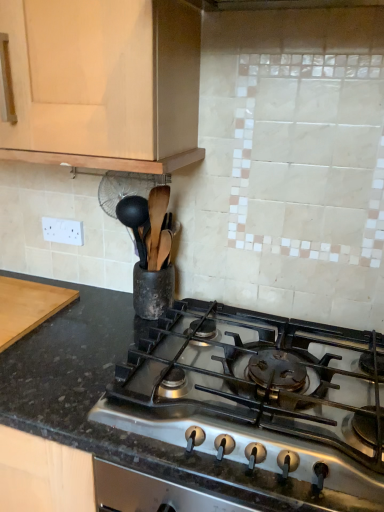
Question: Visually, is wooden cutting board at left positioned to the left or to the right of matte wood cabinet at upper left?

Choices:
 (A) right
 (B) left

Answer: (B)

Question: In the image, is wooden cutting board at left positioned in front of or behind matte wood cabinet at upper left?

Choices:
 (A) behind
 (B) front

Answer: (A)

Question: Which of these objects is positioned closest to the black granite countertop at center?

Choices:
 (A) matte wood cabinet at upper left
 (B) wooden cutting board at left

Answer: (B)

Question: Based on their relative distances, which object is farther from the black granite countertop at center?

Choices:
 (A) wooden cutting board at left
 (B) matte wood cabinet at upper left

Answer: (B)